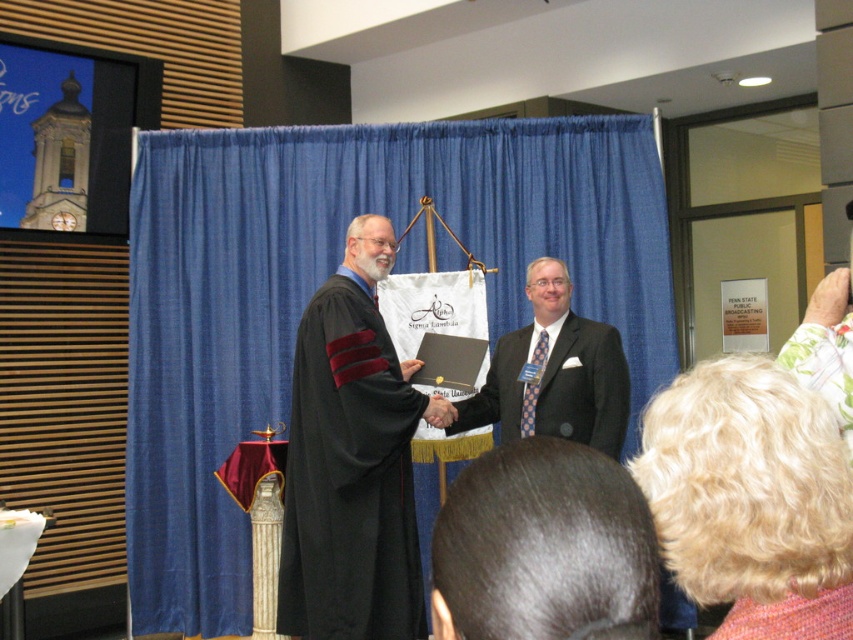
Is dark brown hair at center thinner than black matte robe at center?

Correct, dark brown hair at center's width is less than black matte robe at center's.

Who is positioned more to the right, dark brown hair at center or black matte robe at center?

Positioned to the right is black matte robe at center.

What do you see at coordinates (544, 548) in the screenshot? I see `dark brown hair at center` at bounding box center [544, 548].

You are a GUI agent. You are given a task and a screenshot of the screen. Output one action in this format:
    pyautogui.click(x=<x>, y=<y>)
    Task: Click on the dark brown hair at center
    Image resolution: width=853 pixels, height=640 pixels.
    Given the screenshot: What is the action you would take?
    pyautogui.click(x=544, y=548)

Identify the location of blue fabric curtain at center. The image size is (853, 640). (325, 278).

Looking at this image, can you confirm if black matte graduation gown at center is wider than dark brown hair at center?

Yes.

Can you confirm if black matte graduation gown at center is positioned to the left of dark brown hair at center?

Correct, you'll find black matte graduation gown at center to the left of dark brown hair at center.

Where is `black matte graduation gown at center`? Image resolution: width=853 pixels, height=640 pixels. black matte graduation gown at center is located at coordinates (349, 477).